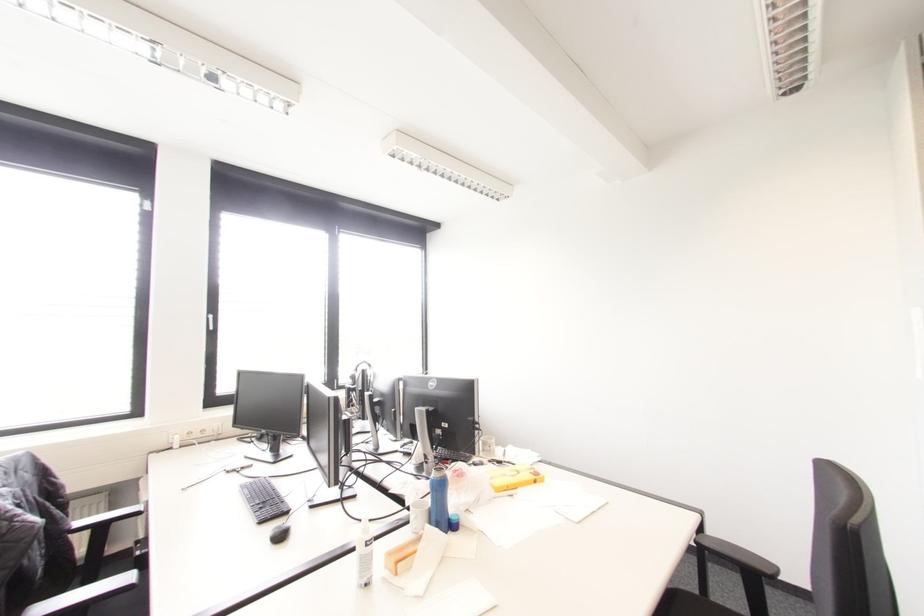
Where would you lift the white glue stick? Please return your answer as a coordinate pair (x, y).

(363, 554)